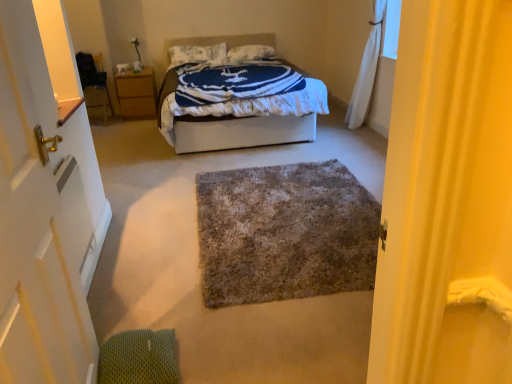
Question: Is wooden nightstand at left at the left side of white fabric bed at center?

Choices:
 (A) no
 (B) yes

Answer: (B)

Question: Is wooden nightstand at left facing towards white fabric bed at center?

Choices:
 (A) yes
 (B) no

Answer: (B)

Question: From the image's perspective, does wooden nightstand at left appear higher than white fabric bed at center?

Choices:
 (A) yes
 (B) no

Answer: (A)

Question: Does wooden nightstand at left come behind white fabric bed at center?

Choices:
 (A) no
 (B) yes

Answer: (B)

Question: From the image's perspective, does wooden nightstand at left appear lower than white fabric bed at center?

Choices:
 (A) no
 (B) yes

Answer: (A)

Question: Does wooden nightstand at left have a greater width compared to white fabric bed at center?

Choices:
 (A) no
 (B) yes

Answer: (A)

Question: From the image's perspective, would you say wooden nightstand at left is positioned over white sheer curtain at upper right?

Choices:
 (A) no
 (B) yes

Answer: (B)

Question: From the image's perspective, does wooden nightstand at left appear lower than white sheer curtain at upper right?

Choices:
 (A) no
 (B) yes

Answer: (A)

Question: Can we say wooden nightstand at left lies outside white sheer curtain at upper right?

Choices:
 (A) no
 (B) yes

Answer: (B)

Question: Is wooden nightstand at left further to the viewer compared to white sheer curtain at upper right?

Choices:
 (A) no
 (B) yes

Answer: (B)

Question: Is wooden nightstand at left positioned with its back to white sheer curtain at upper right?

Choices:
 (A) no
 (B) yes

Answer: (A)

Question: Can white sheer curtain at upper right be found inside wooden nightstand at left?

Choices:
 (A) yes
 (B) no

Answer: (B)

Question: Considering the relative positions of white wooden door at left and white soft pillow at upper center, the 1th pillow from the left, in the image provided, is white wooden door at left to the right of white soft pillow at upper center, the 1th pillow from the left, from the viewer's perspective?

Choices:
 (A) yes
 (B) no

Answer: (A)